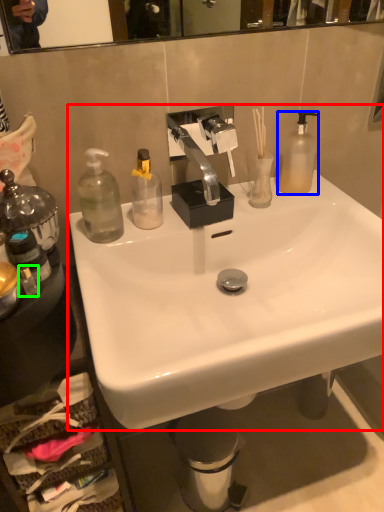
Question: Which object is the farthest from sink (highlighted by a red box)? Choose among these: bottle (highlighted by a blue box) or bottle (highlighted by a green box).

Choices:
 (A) bottle
 (B) bottle

Answer: (B)